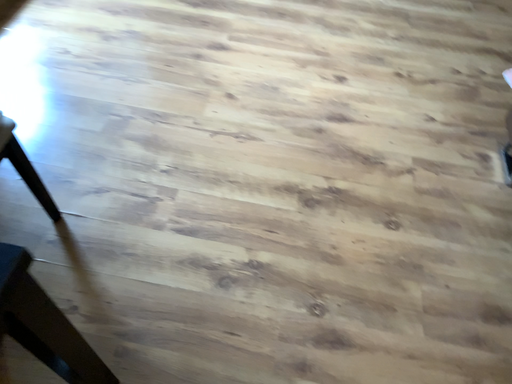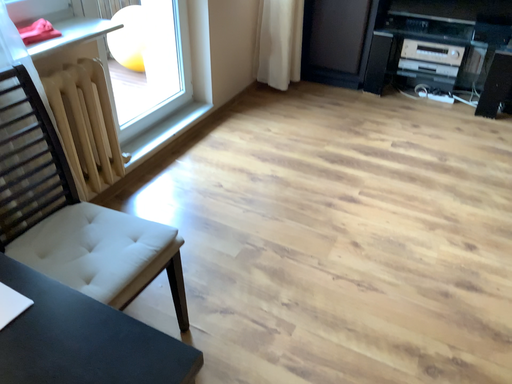
Question: Which way did the camera rotate in the video?

Choices:
 (A) rotated left
 (B) rotated right

Answer: (A)